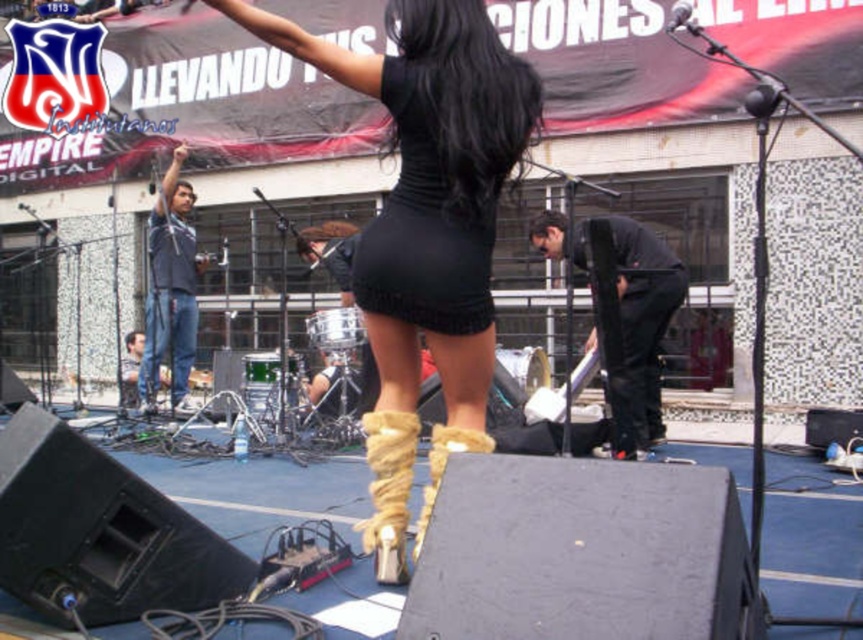
Based on the photo, does leather high-heeled boot at center appear under tan suede boot at center?

No, leather high-heeled boot at center is not below tan suede boot at center.

Is leather high-heeled boot at center positioned at the back of tan suede boot at center?

That is True.

What are the coordinates of `leather high-heeled boot at center` in the screenshot? It's located at (389, 490).

Who is shorter, black knit dress at center or black matte pants at right?

Standing shorter between the two is black knit dress at center.

Between black knit dress at center and black matte pants at right, which one appears on the right side from the viewer's perspective?

black matte pants at right

Image resolution: width=863 pixels, height=640 pixels. What do you see at coordinates (424, 230) in the screenshot?
I see `black knit dress at center` at bounding box center [424, 230].

What are the coordinates of `black knit dress at center` in the screenshot? It's located at (424, 230).

Can you confirm if black matte dress at center is wider than jeans at center?

Yes.

Which of these two, black matte dress at center or jeans at center, stands taller?

With more height is black matte dress at center.

Between point (427, 97) and point (146, 394), which one is positioned in front?

Point (427, 97) is more forward.

Where is `black matte dress at center`? This screenshot has width=863, height=640. black matte dress at center is located at coordinates (425, 228).